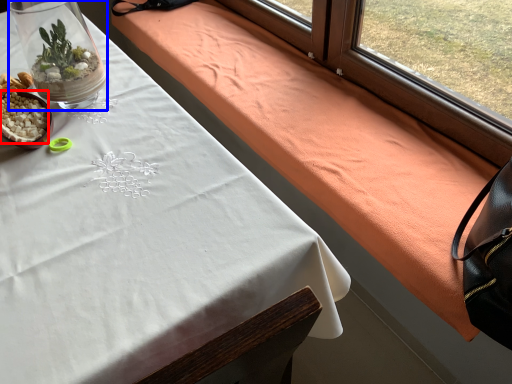
Question: Which of the following is the farthest to the observer, food (highlighted by a red box) or glass vase (highlighted by a blue box)?

Choices:
 (A) food
 (B) glass vase

Answer: (A)